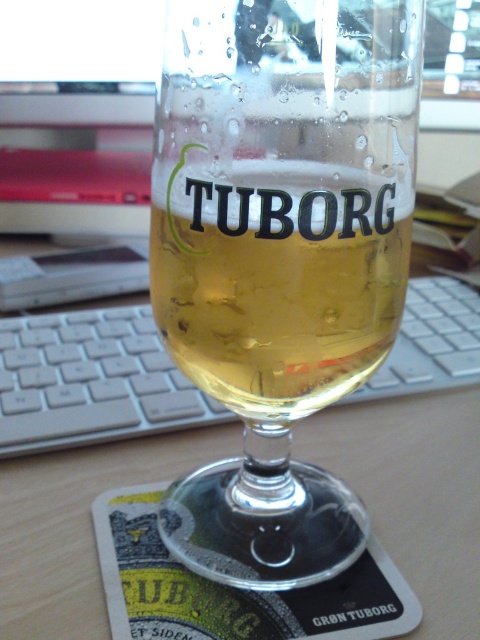
You are trying to pour more beer into the translucent glass beer glass at center. Can you determine if the current level of the translucent glass beer at center will allow more beer to be added without overflowing?

The translucent glass beer glass at center might be wider than the translucent glass beer at center, so there might be enough space to add more beer without overflowing, but it depends on the exact dimensions.

You are holding a smartphone camera and want to take a photo of the translucent glass beer glass at center and the translucent glass beer at center. Which object should you focus on first to ensure both are in sharp focus?

You should focus on the translucent glass beer glass at center first because it is closer to the viewer than the translucent glass beer at center, so focusing on the closer object will ensure the beer is also in focus due to depth of field.